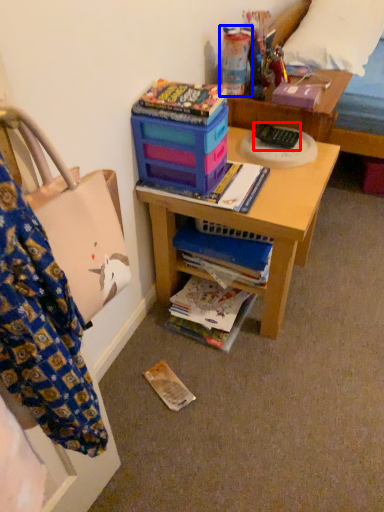
Question: Which of the following is the farthest to the observer, remote control (highlighted by a red box) or toy (highlighted by a blue box)?

Choices:
 (A) remote control
 (B) toy

Answer: (A)